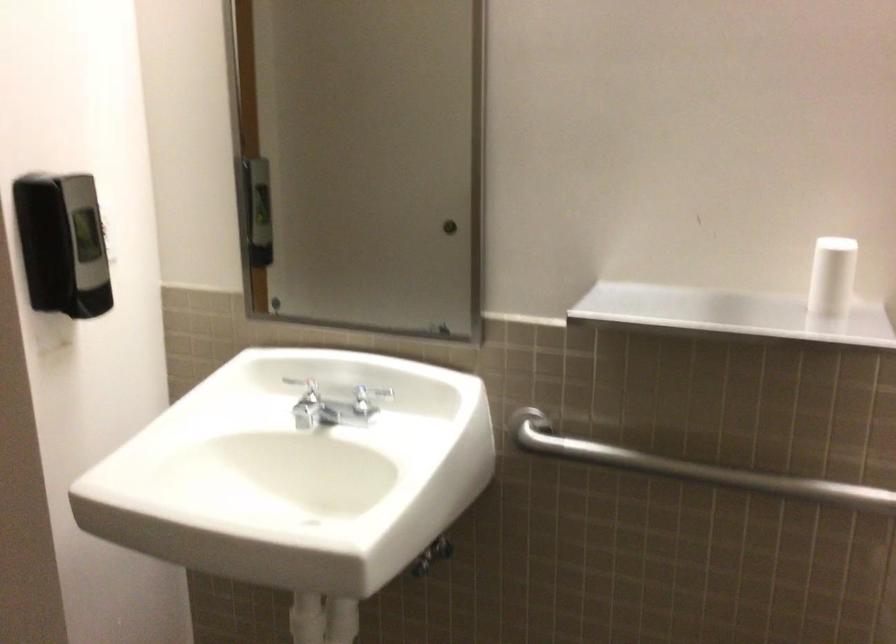
Where is `soap dispenser front`? soap dispenser front is located at coordinates (85, 249).